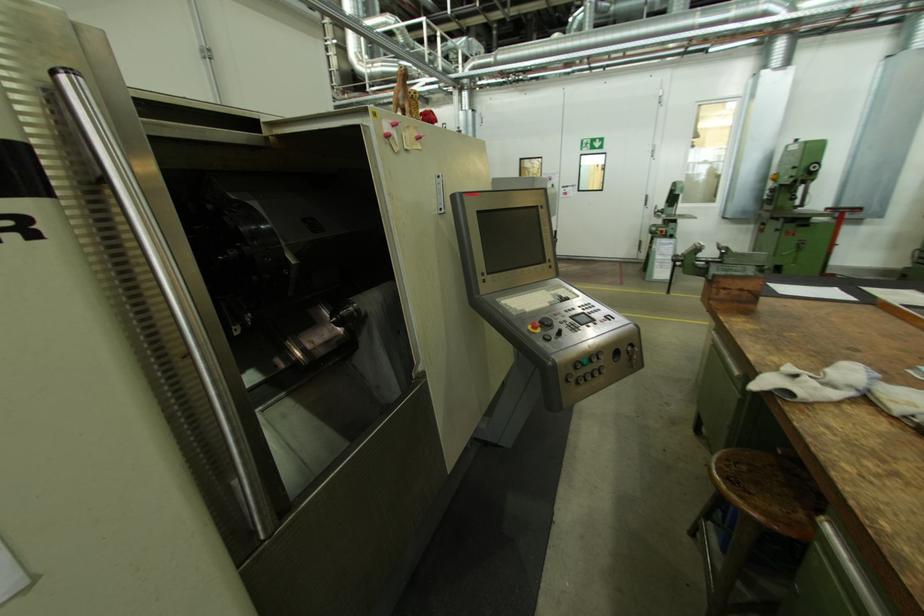
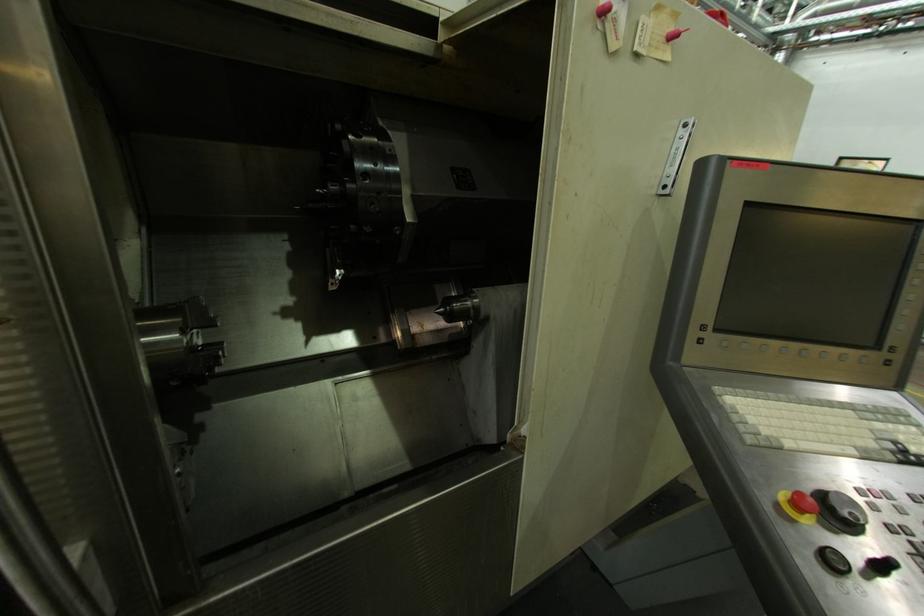
The point at [423,135] is marked in the first image. Where is the corresponding point in the second image?

(677, 30)